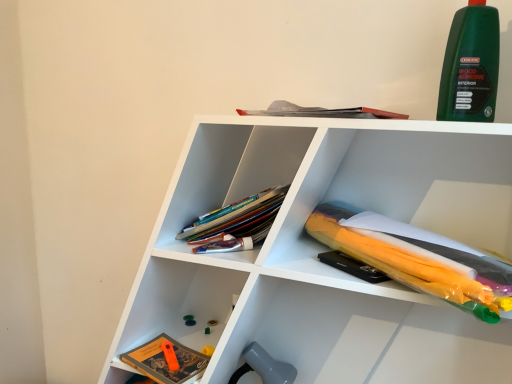
Question: Is hardcover book at lower left, the 1th book viewed from the left, turned away from green plastic toy at lower center?

Choices:
 (A) yes
 (B) no

Answer: (A)

Question: Are hardcover book at lower left, which is counted as the 1th book, starting from the bottom, and green plastic toy at lower center making contact?

Choices:
 (A) no
 (B) yes

Answer: (A)

Question: From a real-world perspective, is hardcover book at lower left, the 1th book viewed from the left, on green plastic toy at lower center?

Choices:
 (A) no
 (B) yes

Answer: (B)

Question: Does hardcover book at lower left, marked as the second book in a top-to-bottom arrangement, have a greater height compared to green plastic toy at lower center?

Choices:
 (A) yes
 (B) no

Answer: (A)

Question: Considering the relative sizes of hardcover book at lower left, marked as the second book in a top-to-bottom arrangement, and green plastic toy at lower center in the image provided, is hardcover book at lower left, marked as the second book in a top-to-bottom arrangement, shorter than green plastic toy at lower center?

Choices:
 (A) yes
 (B) no

Answer: (B)

Question: Relative to white plastic umbrella at upper right, is green matte wood adhesive at upper right in front or behind?

Choices:
 (A) behind
 (B) front

Answer: (A)

Question: Is green matte wood adhesive at upper right spatially inside white plastic umbrella at upper right, or outside of it?

Choices:
 (A) inside
 (B) outside

Answer: (B)

Question: In terms of height, does green matte wood adhesive at upper right look taller or shorter compared to white plastic umbrella at upper right?

Choices:
 (A) short
 (B) tall

Answer: (A)

Question: Considering the positions of green matte wood adhesive at upper right and white plastic umbrella at upper right in the image, is green matte wood adhesive at upper right wider or thinner than white plastic umbrella at upper right?

Choices:
 (A) wide
 (B) thin

Answer: (B)

Question: Does point (202, 370) appear closer or farther from the camera than point (489, 6)?

Choices:
 (A) farther
 (B) closer

Answer: (A)

Question: From a real-world perspective, is hardcover book at lower left, the second book positioned from the right, above or below green matte wood adhesive at upper right?

Choices:
 (A) above
 (B) below

Answer: (B)

Question: From the image's perspective, is hardcover book at lower left, the 1th book viewed from the left, located above or below green matte wood adhesive at upper right?

Choices:
 (A) below
 (B) above

Answer: (A)

Question: Is hardcover book at lower left, the second book positioned from the right, in front of or behind green matte wood adhesive at upper right in the image?

Choices:
 (A) behind
 (B) front

Answer: (A)

Question: Based on their positions, is green plastic toy at lower center located to the left or right of translucent plastic umbrella at lower right, the second book from the bottom?

Choices:
 (A) left
 (B) right

Answer: (A)

Question: Looking at their shapes, would you say green plastic toy at lower center is wider or thinner than translucent plastic umbrella at lower right, which is counted as the first book, starting from the right?

Choices:
 (A) thin
 (B) wide

Answer: (A)